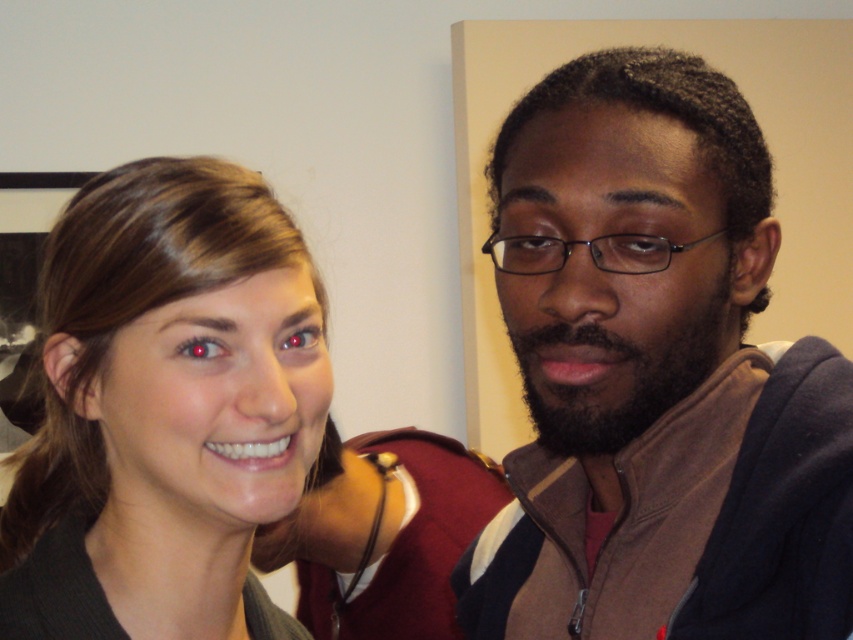
You are a photographer trying to capture a group photo of two people. You notice the brown fleece jacket at right and the smooth skin face at center in your frame. Which object is positioned to the right of the other?

The brown fleece jacket at right is to the right of the smooth skin face at center.

You are a photographer setting up a shoot in this scene. You need to ensure that the brown fleece jacket at right and the smooth skin face at center are both in focus. Given that your camera can only focus on objects within a 10cm height difference, will both objects be in focus?

The brown fleece jacket at right is taller than the smooth skin face at center. Since the height difference is not specified, but the camera requires objects within 10cm to be in focus, it is possible they could be in focus if the height difference is under 10cm. However, without exact measurements, we cannot confirm for sure.